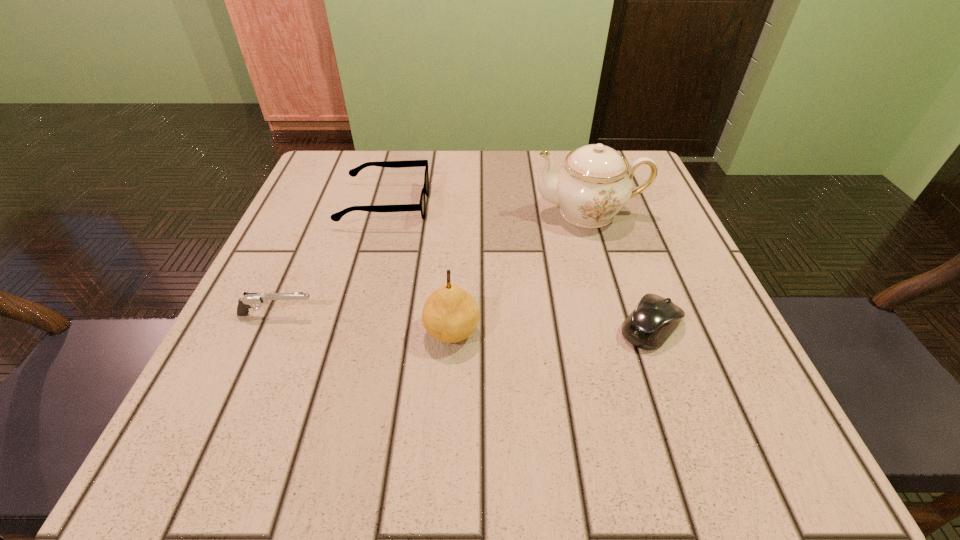
Locate an element on the screen. object at the far right corner is located at coordinates (595, 182).

In the image, there is a desktop. Where is `free region at the far edge`? This screenshot has height=540, width=960. free region at the far edge is located at coordinates (423, 160).

Find the location of a particular element. vacant space at the near edge is located at coordinates (535, 418).

Image resolution: width=960 pixels, height=540 pixels. I want to click on free space at the left edge of the desktop, so click(x=221, y=403).

In the image, there is a desktop. Identify the location of vacant area at the right edge. This screenshot has width=960, height=540. (688, 278).

This screenshot has height=540, width=960. In order to click on free region at the near left corner of the desktop in this screenshot , I will do `click(201, 436)`.

Locate an element on the screen. Image resolution: width=960 pixels, height=540 pixels. free region at the near right corner is located at coordinates (696, 460).

Identify the location of unoccupied area between the tallest object and the pistol. This screenshot has width=960, height=540. (433, 264).

Locate an element on the screen. The height and width of the screenshot is (540, 960). vacant space that is in between the pistol and the tallest object is located at coordinates (433, 264).

What are the coordinates of `free point between the tallest object and the pear` in the screenshot? It's located at (520, 272).